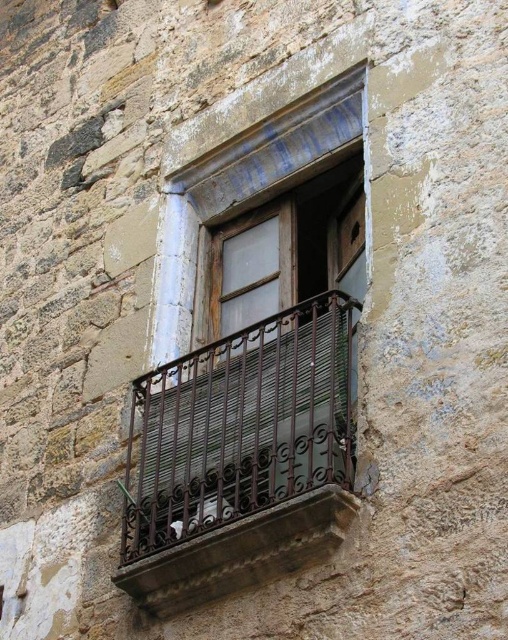
Who is positioned more to the right, rusty metal balcony at center or brown wrought iron at center?

From the viewer's perspective, brown wrought iron at center appears more on the right side.

The image size is (508, 640). What do you see at coordinates (239, 458) in the screenshot?
I see `rusty metal balcony at center` at bounding box center [239, 458].

Does point (239, 540) come in front of point (263, 525)?

No, it is behind (263, 525).

Identify the location of rusty metal balcony at center. The image size is (508, 640). (239, 458).